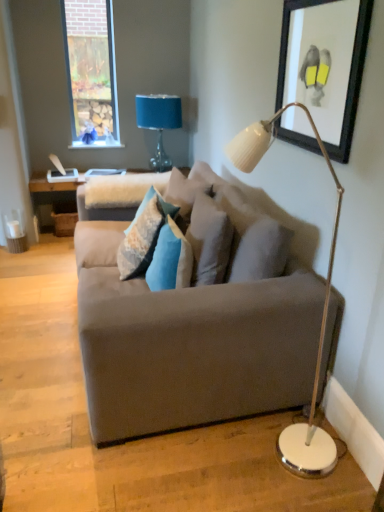
Question: Would you say black matte picture frame at upper right is inside or outside textured blue pillow at center, the 1th pillow when ordered from left to right?

Choices:
 (A) inside
 (B) outside

Answer: (B)

Question: Considering the positions of point (292, 128) and point (153, 223), is point (292, 128) closer or farther from the camera than point (153, 223)?

Choices:
 (A) farther
 (B) closer

Answer: (B)

Question: Which object is the closest to the textured gray pillow at center, which appears as the 3th pillow when viewed from the left?

Choices:
 (A) black matte picture frame at upper right
 (B) blue velvet pillow at center, arranged as the 2th pillow when viewed from the left
 (C) suede gray couch at center
 (D) textured blue pillow at center, which ranks as the third pillow in right-to-left order
 (E) blue fabric lampshade at upper center

Answer: (B)

Question: Which object is positioned farthest from the textured gray pillow at center, the first pillow in the right-to-left sequence?

Choices:
 (A) blue velvet pillow at center, arranged as the 2th pillow when viewed from the left
 (B) white glossy floor lamp at right
 (C) black matte picture frame at upper right
 (D) textured blue pillow at center, which ranks as the third pillow in right-to-left order
 (E) suede gray couch at center

Answer: (C)